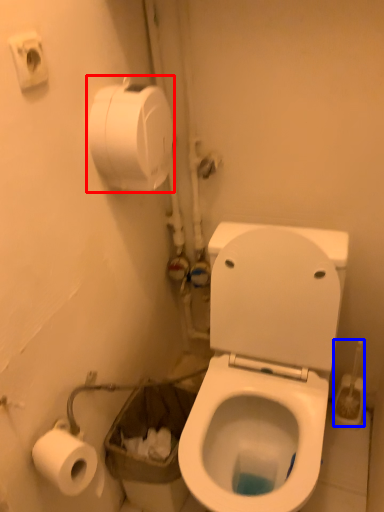
Question: Which object appears farthest to the camera in this image, toilet paper (highlighted by a red box) or brush (highlighted by a blue box)?

Choices:
 (A) toilet paper
 (B) brush

Answer: (B)